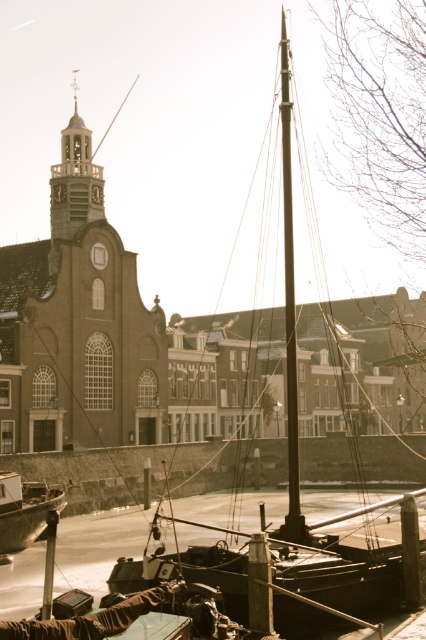
You are standing on the dock and see two points in the water. The first point is at coordinates point (92, 198) and the second is at point (37, 518). Which point is closer to you?

Point (37, 518) is closer to you because it is in front of point (92, 198).

You are a photographer standing at the edge of the dock, aiming to capture the black polished wood mast at center in your shot. Given that your camera has a field of view that covers a rectangular area from coordinates 0.4 to 0.6 on the horizontal axis and 0.6 to 0.8 on the vertical axis, will the mast be fully within the camera frame?

The black polished wood mast at center is located at point (290, 307). The camera frame covers 0.4 to 0.6 horizontally and 0.6 to 0.8 vertically. Since the mast is at 0.480 horizontally and 0.681 vertically, both coordinates fall within the camera frame. Therefore, the mast will be fully within the camera frame.

You are standing at the center of the image and want to locate the wooden sailboat at center. What are its coordinates?

The wooden sailboat at center is located at coordinates (290, 300).